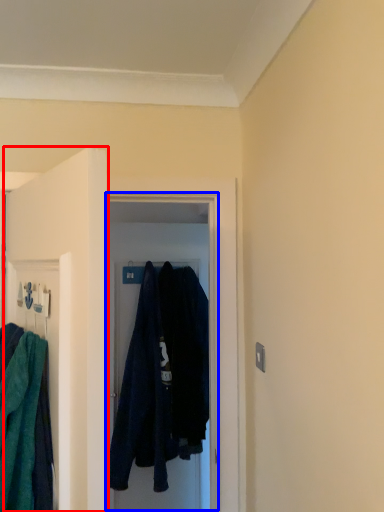
Question: Which object appears closest to the camera in this image, door (highlighted by a red box) or glass door (highlighted by a blue box)?

Choices:
 (A) door
 (B) glass door

Answer: (A)